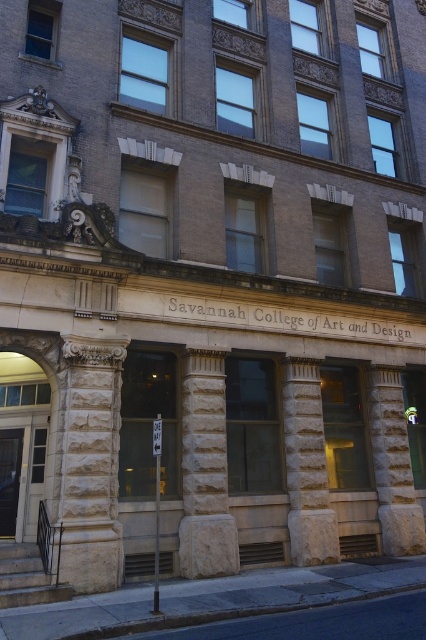
Which is behind, point (310, 513) or point (402, 435)?

The point (402, 435) is more distant.

Does point (287, 483) come in front of point (416, 525)?

Yes, it is in front of point (416, 525).

What do you see at coordinates (307, 465) in the screenshot?
I see `light beige stone column at center` at bounding box center [307, 465].

Find the location of a particular element. This screenshot has height=640, width=426. light beige stone column at center is located at coordinates (307, 465).

Does white stone column at center appear on the left side of light beige stone column at center?

Yes, white stone column at center is to the left of light beige stone column at center.

Measure the distance between white stone column at center and camera.

9.77 meters

I want to click on white stone column at center, so click(204, 470).

Can you confirm if stone textured column at left is smaller than gray stone column at center?

No, stone textured column at left is not smaller than gray stone column at center.

Is stone textured column at left closer to the viewer compared to gray stone column at center?

Yes.

Who is more forward, (92, 497) or (377, 392)?

Point (92, 497) is in front.

The image size is (426, 640). I want to click on stone textured column at left, so click(91, 464).